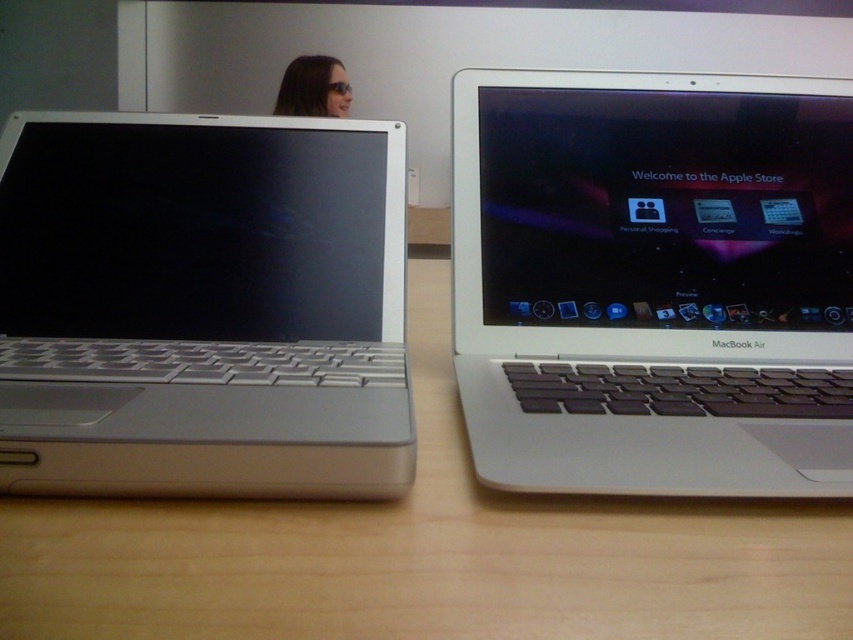
Between silver metallic laptop at left and matte black sunglasses at upper left, which one is positioned lower?

silver metallic laptop at left

Which is more to the left, silver metallic laptop at left or matte black sunglasses at upper left?

matte black sunglasses at upper left

Where is `silver metallic laptop at left`? This screenshot has width=853, height=640. silver metallic laptop at left is located at coordinates (202, 307).

Between point (141, 467) and point (552, 637), which one is positioned behind?

The point (141, 467) is more distant.

The height and width of the screenshot is (640, 853). I want to click on silver metallic laptop at left, so click(x=202, y=307).

Where is `silver metallic laptop at center`? This screenshot has width=853, height=640. silver metallic laptop at center is located at coordinates (653, 282).

Is silver metallic laptop at center smaller than wooden table at center?

No.

Is point (636, 481) farther from viewer compared to point (602, 589)?

Yes, it is.

This screenshot has height=640, width=853. Find the location of `silver metallic laptop at center`. silver metallic laptop at center is located at coordinates (653, 282).